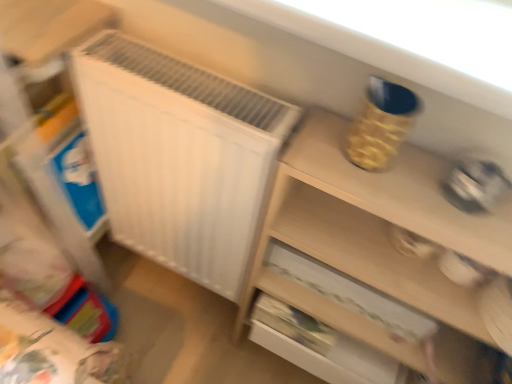
Locate an element on the screen. light wood chest of drawers at upper right is located at coordinates 378,244.

What is the approximate width of light wood chest of drawers at upper right?

It is 6.19 inches.

Describe the element at coordinates (378, 244) in the screenshot. I see `light wood chest of drawers at upper right` at that location.

Where is `light wood chest of drawers at upper right`? light wood chest of drawers at upper right is located at coordinates point(378,244).